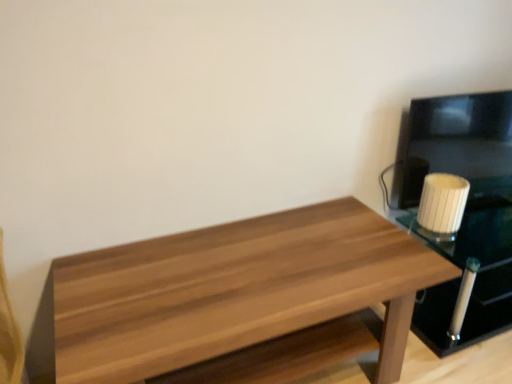
Question: Can you confirm if white glossy candle at right is wider than white ribbed glass at right?

Choices:
 (A) yes
 (B) no

Answer: (A)

Question: Is white glossy candle at right facing towards white ribbed glass at right?

Choices:
 (A) no
 (B) yes

Answer: (A)

Question: Is there a large distance between white glossy candle at right and white ribbed glass at right?

Choices:
 (A) no
 (B) yes

Answer: (A)

Question: From the image's perspective, is white glossy candle at right on white ribbed glass at right?

Choices:
 (A) no
 (B) yes

Answer: (A)

Question: From a real-world perspective, is white glossy candle at right physically above white ribbed glass at right?

Choices:
 (A) yes
 (B) no

Answer: (B)

Question: Is white ribbed glass at right at the back of white glossy candle at right?

Choices:
 (A) no
 (B) yes

Answer: (A)

Question: Considering the relative positions of white glossy candle at right and wooden table at center in the image provided, is white glossy candle at right to the right of wooden table at center from the viewer's perspective?

Choices:
 (A) no
 (B) yes

Answer: (B)

Question: Is white glossy candle at right positioned far away from wooden table at center?

Choices:
 (A) yes
 (B) no

Answer: (B)

Question: From the image's perspective, does white glossy candle at right appear lower than wooden table at center?

Choices:
 (A) yes
 (B) no

Answer: (B)

Question: Considering the relative positions of white glossy candle at right and wooden table at center in the image provided, is white glossy candle at right to the left of wooden table at center from the viewer's perspective?

Choices:
 (A) yes
 (B) no

Answer: (B)

Question: Is white glossy candle at right wider than wooden table at center?

Choices:
 (A) yes
 (B) no

Answer: (B)

Question: From a real-world perspective, is white glossy candle at right under wooden table at center?

Choices:
 (A) no
 (B) yes

Answer: (B)

Question: Does wooden table at center have a smaller size compared to white glossy candle at right?

Choices:
 (A) yes
 (B) no

Answer: (B)